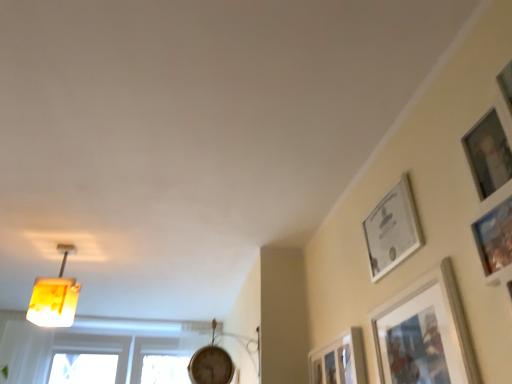
Question: Considering the positions of point (399, 345) and point (416, 226), is point (399, 345) closer or farther from the camera than point (416, 226)?

Choices:
 (A) closer
 (B) farther

Answer: (B)

Question: Based on their positions, is matte silver picture frame at upper right, which is the first picture frame in right-to-left order, located to the left or right of white glossy picture frame at upper right, which is the 2th picture frame from right to left?

Choices:
 (A) right
 (B) left

Answer: (A)

Question: Considering the real-world distances, which object is farthest from the matte silver picture frame at upper right, which is the first picture frame in right-to-left order?

Choices:
 (A) yellow translucent lampshade at upper left
 (B) matte silver picture frame at lower right, the 3th picture frame when ordered from right to left
 (C) white glossy picture frame at upper right, which is the 2th picture frame from right to left

Answer: (A)

Question: Estimate the real-world distances between objects in this image. Which object is closer to the matte silver picture frame at upper right, the third picture frame viewed from the left?

Choices:
 (A) yellow translucent lampshade at upper left
 (B) white glossy picture frame at upper right, the 2th picture frame positioned from the left
 (C) matte silver picture frame at lower right, the 3th picture frame when ordered from right to left

Answer: (B)